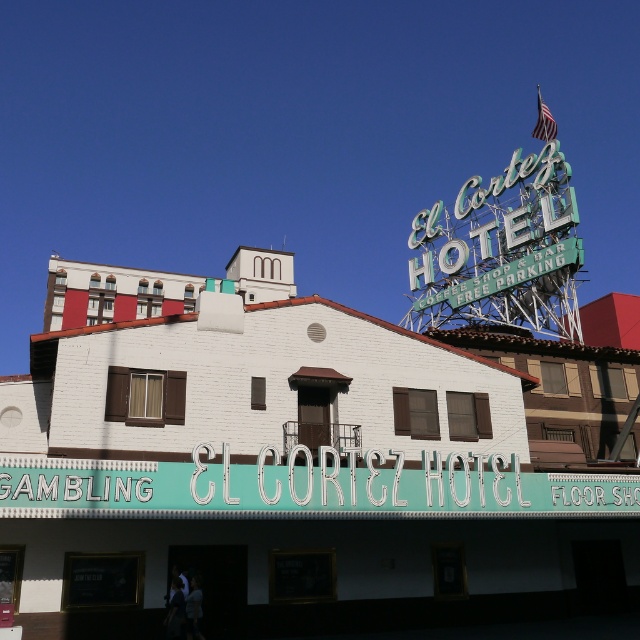
Question: Does white brick theater at center appear over teal metallic sign at center?

Choices:
 (A) no
 (B) yes

Answer: (B)

Question: Which object appears closest to the camera in this image?

Choices:
 (A) teal metallic sign at center
 (B) white brick theater at center

Answer: (A)

Question: Does white brick theater at center have a greater width compared to teal metallic sign at center?

Choices:
 (A) no
 (B) yes

Answer: (B)

Question: Is white brick theater at center further to the viewer compared to teal metallic sign at center?

Choices:
 (A) no
 (B) yes

Answer: (B)